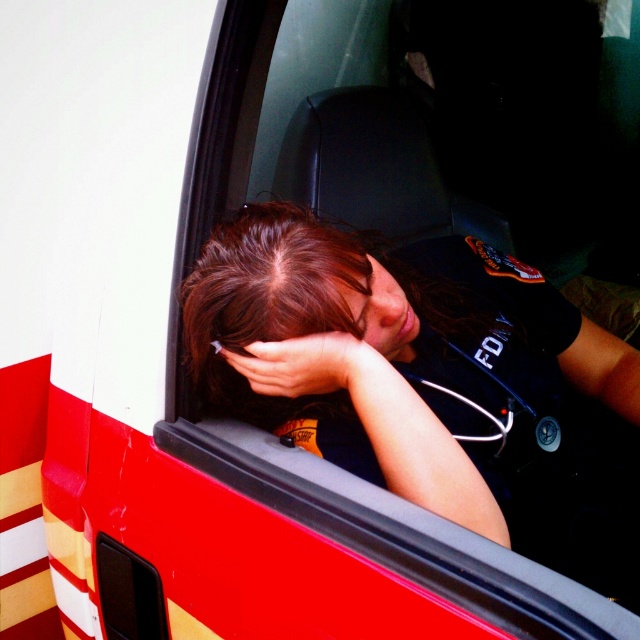
Question: Does smooth skin hand at center lie in front of smooth skin face at center?

Choices:
 (A) no
 (B) yes

Answer: (B)

Question: Which of these objects is positioned farthest from the smooth skin hand at center?

Choices:
 (A) dark blue uniform at center
 (B) dark brown hair at center
 (C) smooth skin face at center

Answer: (A)

Question: Which object is the farthest from the dark brown hair at center?

Choices:
 (A) smooth skin hand at center
 (B) dark blue uniform at center

Answer: (A)

Question: Can you confirm if dark brown hair at center is positioned above smooth skin hand at center?

Choices:
 (A) no
 (B) yes

Answer: (B)

Question: Can you confirm if smooth skin hand at center is positioned to the right of smooth skin face at center?

Choices:
 (A) no
 (B) yes

Answer: (A)

Question: Estimate the real-world distances between objects in this image. Which object is farther from the smooth skin hand at center?

Choices:
 (A) smooth skin face at center
 (B) dark brown hair at center
 (C) dark blue uniform at center

Answer: (C)